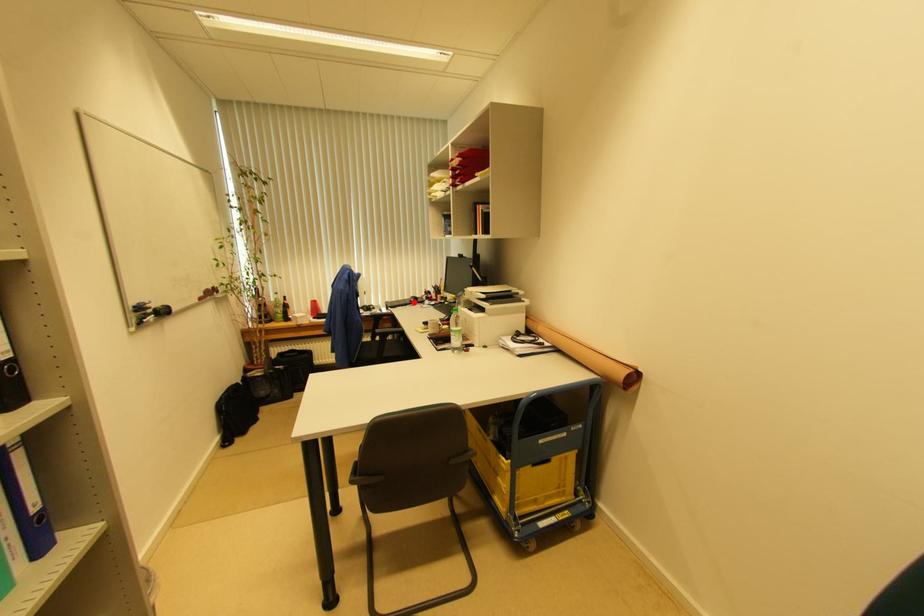
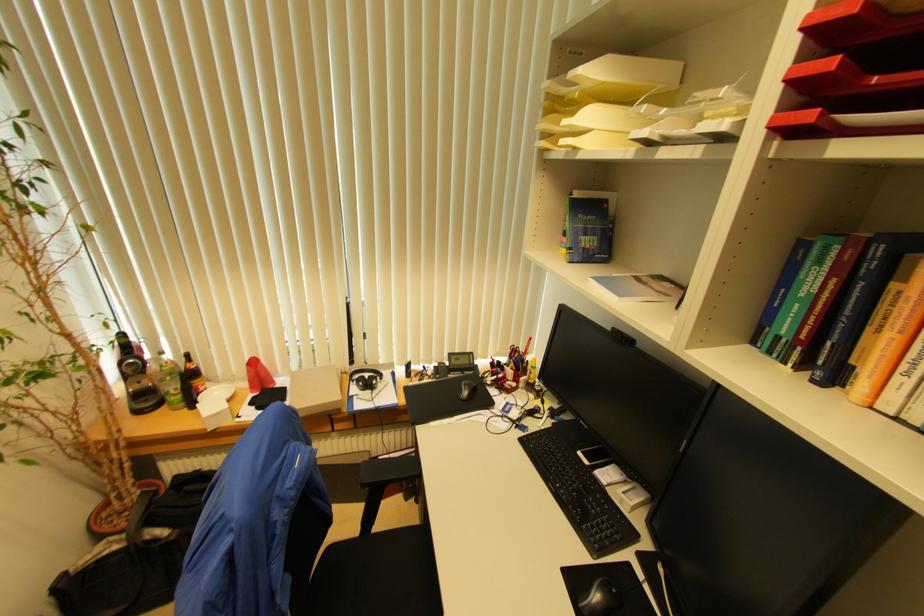
Where in the second image is the point corresponding to the highlighted location from the first image?

(467, 395)